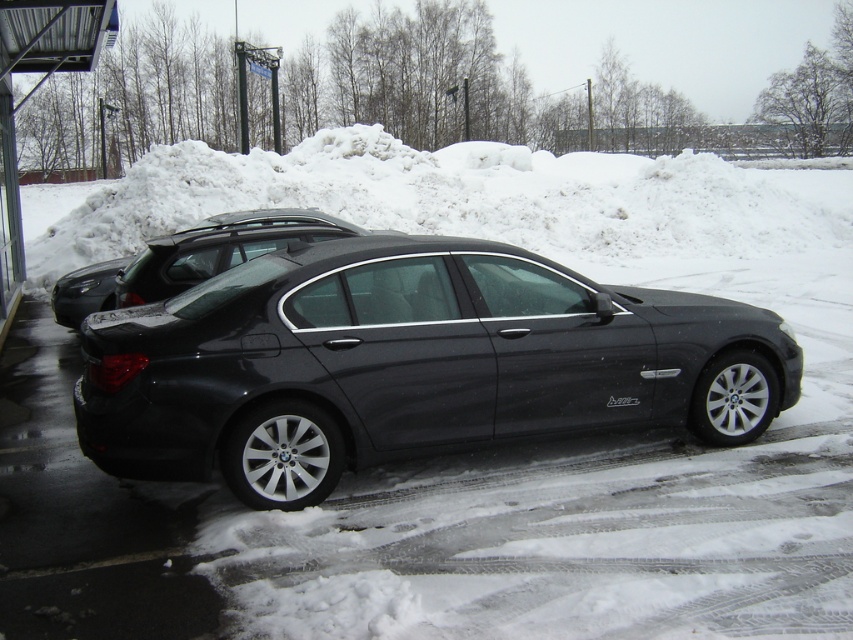
You are a delivery driver who needs to park your van between the satin black sedan at center and the metallic silver bus stop at left. Considering their sizes, will there be enough space for your van to fit between them?

The satin black sedan at center is smaller than the metallic silver bus stop at left. However, the description only provides information about their relative sizes, not the distance between them. Without knowing the actual spacing between the two objects, it is impossible to determine if there is sufficient room for the van to fit between them.

You are standing at the point with coordinates (409, 364) in the snowy scene. Which car are you touching? The scene has a satin black sedan at center and another car partially hidden behind it. Mention the exact object label from the objects list in your answer.

The point at coordinates (409, 364) is on the satin black sedan at center, so you are touching the satin black sedan at center.